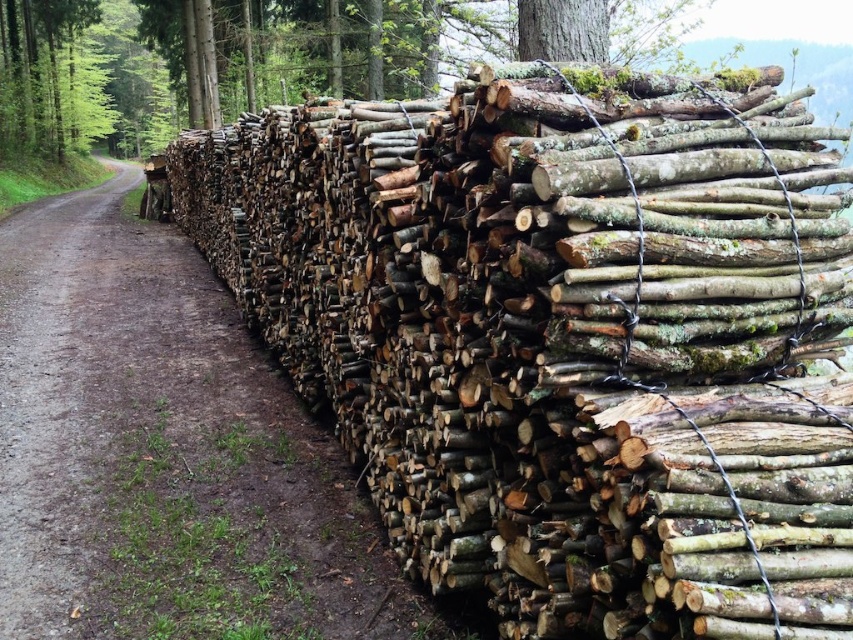
Is the position of natural wood logs at right less distant than that of green mossy bark at upper center?

That is True.

Does point (744, 577) come in front of point (537, 22)?

That is True.

This screenshot has width=853, height=640. I want to click on natural wood logs at right, so tap(566, 333).

Measure the distance between green mossy bark at upper center and green rough bark tree trunk at upper center.

12.09 meters

Which is more to the right, green mossy bark at upper center or green rough bark tree trunk at upper center?

Positioned to the right is green mossy bark at upper center.

Between point (566, 44) and point (204, 83), which one is positioned in front?

Point (566, 44) is in front.

What are the coordinates of `green mossy bark at upper center` in the screenshot? It's located at (561, 29).

Which is more to the left, natural wood logs at right or green rough bark tree trunk at upper center?

green rough bark tree trunk at upper center

Between point (653, 224) and point (196, 54), which one is positioned in front?

Point (653, 224) is more forward.

Which is in front, point (734, 310) or point (199, 52)?

Point (734, 310) is in front.

Identify the location of natural wood logs at right. This screenshot has width=853, height=640. (566, 333).